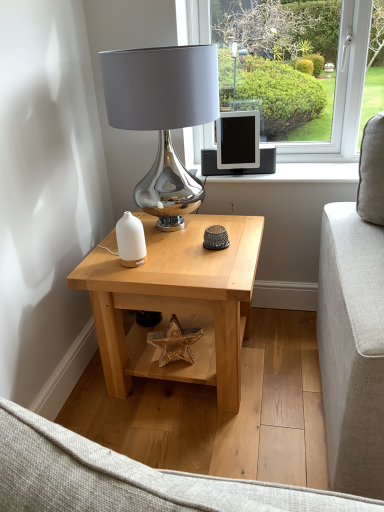
Image resolution: width=384 pixels, height=512 pixels. I want to click on white glossy candle holder at center, so click(x=131, y=240).

Locate an element on the screen. This screenshot has height=512, width=384. natural wood table at center is located at coordinates (177, 303).

The width and height of the screenshot is (384, 512). In order to click on white glossy candle holder at center in this screenshot , I will do `click(131, 240)`.

Can shiny metallic lamp at center be found inside matte black tablet at center?

No, shiny metallic lamp at center is located outside of matte black tablet at center.

In the image, is matte black tablet at center positioned in front of or behind shiny metallic lamp at center?

Clearly, matte black tablet at center is behind shiny metallic lamp at center.

Between matte black tablet at center and shiny metallic lamp at center, which one has larger width?

Wider between the two is shiny metallic lamp at center.

Is matte black tablet at center positioned far away from shiny metallic lamp at center?

No.

Does natural wood table at center touch matte black tablet at center?

No, natural wood table at center is not touching matte black tablet at center.

Is natural wood table at center outside of matte black tablet at center?

Indeed, natural wood table at center is completely outside matte black tablet at center.

Does natural wood table at center appear on the right side of matte black tablet at center?

No, natural wood table at center is not to the right of matte black tablet at center.

Which object is closer to the camera taking this photo, natural wood table at center or matte black tablet at center?

natural wood table at center.

This screenshot has height=512, width=384. What are the coordinates of `table lamp that is in front of the natural wood table at center` in the screenshot? It's located at (163, 117).

Is shiny metallic lamp at center positioned in front of natural wood table at center?

Yes, shiny metallic lamp at center is closer to the viewer.

Considering the points (134, 247) and (202, 55), which point is behind, point (134, 247) or point (202, 55)?

The point (134, 247) is behind.

Looking at this image, looking at their sizes, would you say white glossy candle holder at center is wider or thinner than shiny metallic lamp at center?

white glossy candle holder at center is thinner than shiny metallic lamp at center.

Is white glossy candle holder at center with shiny metallic lamp at center?

No, white glossy candle holder at center is not next to shiny metallic lamp at center.

Considering the relative positions of white glossy candle holder at center and shiny metallic lamp at center in the image provided, is white glossy candle holder at center to the right of shiny metallic lamp at center from the viewer's perspective?

No, white glossy candle holder at center is not to the right of shiny metallic lamp at center.

Considering the positions of objects white glossy candle holder at center and natural wood table at center in the image provided, who is more to the right, white glossy candle holder at center or natural wood table at center?

Positioned to the right is natural wood table at center.

Are white glossy candle holder at center and natural wood table at center making contact?

No, white glossy candle holder at center is not next to natural wood table at center.

Considering the positions of objects white glossy candle holder at center and natural wood table at center in the image provided, who is behind, white glossy candle holder at center or natural wood table at center?

white glossy candle holder at center is more distant.

From a real-world perspective, is matte black tablet at center positioned above or below white glossy candle holder at center?

matte black tablet at center is above white glossy candle holder at center.

Considering the points (234, 123) and (121, 232), which point is behind, point (234, 123) or point (121, 232)?

The point (234, 123) is farther.

Between matte black tablet at center and white glossy candle holder at center, which one has less height?

Standing shorter between the two is white glossy candle holder at center.

From the picture: Is matte black tablet at center thinner than white glossy candle holder at center?

Incorrect, the width of matte black tablet at center is not less than that of white glossy candle holder at center.

Which of these two, matte black tablet at center or natural wood table at center, stands shorter?

matte black tablet at center is shorter.

Does matte black tablet at center lie in front of natural wood table at center?

No, it is not.

Could you tell me if matte black tablet at center is facing natural wood table at center?

No, matte black tablet at center is not aimed at natural wood table at center.

Measure the distance from matte black tablet at center to natural wood table at center.

matte black tablet at center and natural wood table at center are 63.62 centimeters apart from each other.

Find the location of a particular element. The image size is (384, 512). computer monitor above the shiny metallic lamp at center (from the image's perspective) is located at coordinates (238, 140).

Locate an element on the screen. The width and height of the screenshot is (384, 512). table in front of the matte black tablet at center is located at coordinates (177, 303).

Looking at the image, which one is located closer to white glossy candle holder at center, matte black tablet at center or natural wood table at center?

A: natural wood table at center is positioned closer to the anchor white glossy candle holder at center.

Which object lies further to the anchor point white glossy candle holder at center, matte black tablet at center or shiny metallic lamp at center?

Based on the image, matte black tablet at center appears to be further to white glossy candle holder at center.

When comparing their distances from matte black tablet at center, does natural wood table at center or shiny metallic lamp at center seem closer?

shiny metallic lamp at center is closer to matte black tablet at center.

From the image, which object appears to be nearer to natural wood table at center, shiny metallic lamp at center or white glossy candle holder at center?

Among the two, white glossy candle holder at center is located nearer to natural wood table at center.

Based on the photo, looking at the image, which one is located further to white glossy candle holder at center, shiny metallic lamp at center or matte black tablet at center?

Among the two, matte black tablet at center is located further to white glossy candle holder at center.

When comparing their distances from natural wood table at center, does white glossy candle holder at center or shiny metallic lamp at center seem further?

shiny metallic lamp at center.

From the image, which object appears to be farther from shiny metallic lamp at center, matte black tablet at center or white glossy candle holder at center?

The object further to shiny metallic lamp at center is matte black tablet at center.

Which object lies further to the anchor point matte black tablet at center, shiny metallic lamp at center or white glossy candle holder at center?

white glossy candle holder at center.

Where is `candle holder located between shiny metallic lamp at center and matte black tablet at center in the depth direction`? candle holder located between shiny metallic lamp at center and matte black tablet at center in the depth direction is located at coordinates pos(131,240).

This screenshot has width=384, height=512. Identify the location of candle holder that lies between matte black tablet at center and natural wood table at center from top to bottom. coord(131,240).

Locate an element on the screen. The width and height of the screenshot is (384, 512). table lamp between matte black tablet at center and natural wood table at center vertically is located at coordinates (163, 117).

Locate an element on the screen. The image size is (384, 512). candle holder between shiny metallic lamp at center and natural wood table at center in the up-down direction is located at coordinates (131, 240).